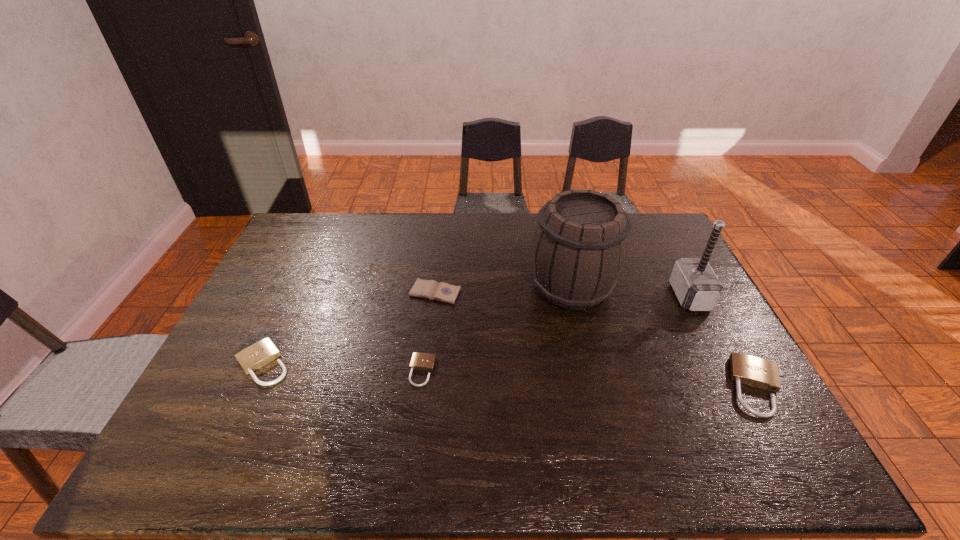
You are a GUI agent. You are given a task and a screenshot of the screen. Output one action in this format:
    pyautogui.click(x=<x>, y=<y>)
    Task: Click on the vacant point located 0.150m on the front of the third object from right to left
    
    Given the screenshot: What is the action you would take?
    pyautogui.click(x=588, y=358)

The height and width of the screenshot is (540, 960). I want to click on free space located 0.140m on the left of the diary, so click(365, 292).

The height and width of the screenshot is (540, 960). What are the coordinates of `vacant space located for striking with the head of the hammer` in the screenshot? It's located at (638, 296).

Where is `vacant space located for striking with the head of the hammer`? This screenshot has height=540, width=960. vacant space located for striking with the head of the hammer is located at coordinates (545, 296).

Identify the location of free point located for striking with the head of the hammer. The width and height of the screenshot is (960, 540). (603, 296).

Locate an element on the screen. This screenshot has height=540, width=960. object present at the near edge is located at coordinates (745, 369).

This screenshot has width=960, height=540. I want to click on object that is positioned at the left edge, so click(252, 358).

Locate an element on the screen. padlock at the right edge is located at coordinates (745, 369).

Where is `hammer present at the right edge`? This screenshot has height=540, width=960. hammer present at the right edge is located at coordinates (697, 287).

Find the location of `object present at the near right corner`. object present at the near right corner is located at coordinates (745, 369).